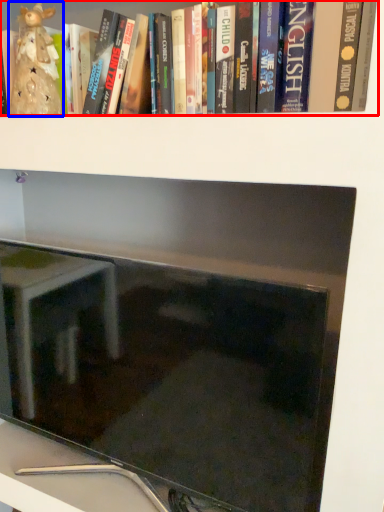
Question: Which object appears farthest to the camera in this image, book (highlighted by a red box) or figurine (highlighted by a blue box)?

Choices:
 (A) book
 (B) figurine

Answer: (B)